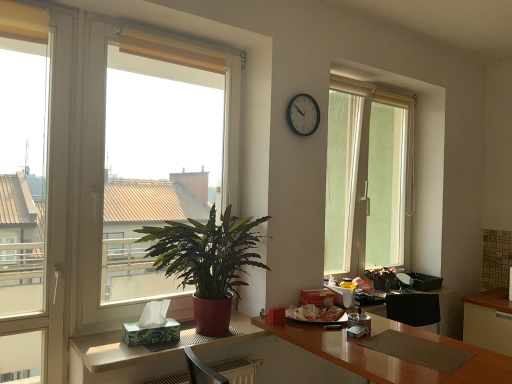
Locate an element on the screen. This screenshot has height=384, width=512. vacant space situated above green leafy plant at left (from a real-world perspective) is located at coordinates (170, 34).